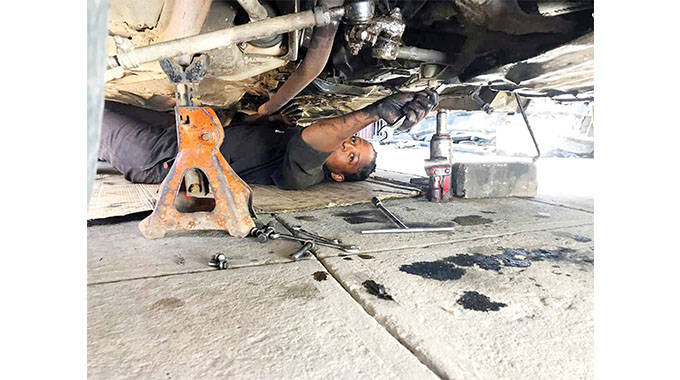
Find the location of a particular element. This screenshot has height=380, width=680. lines between tiles is located at coordinates (130, 276), (409, 348), (492, 235), (282, 218).